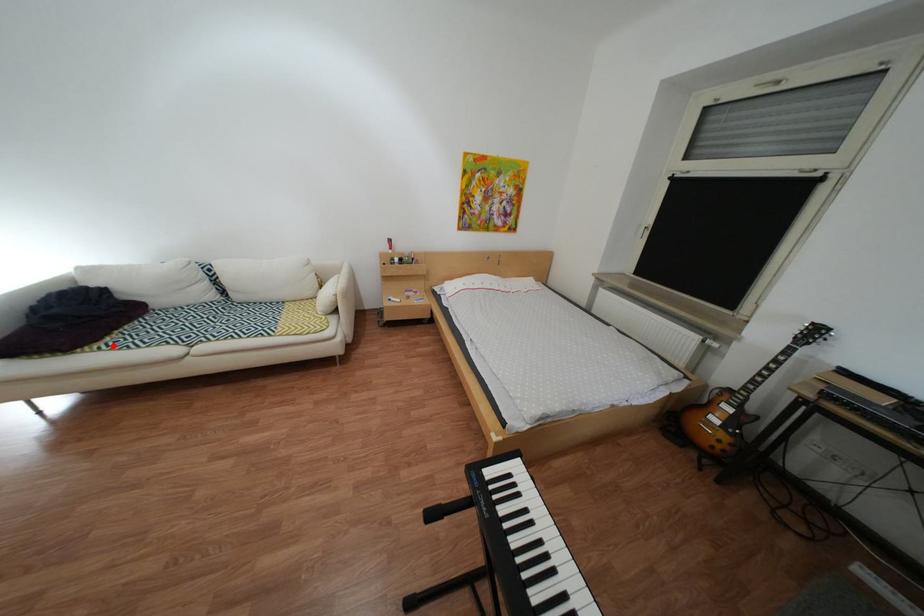
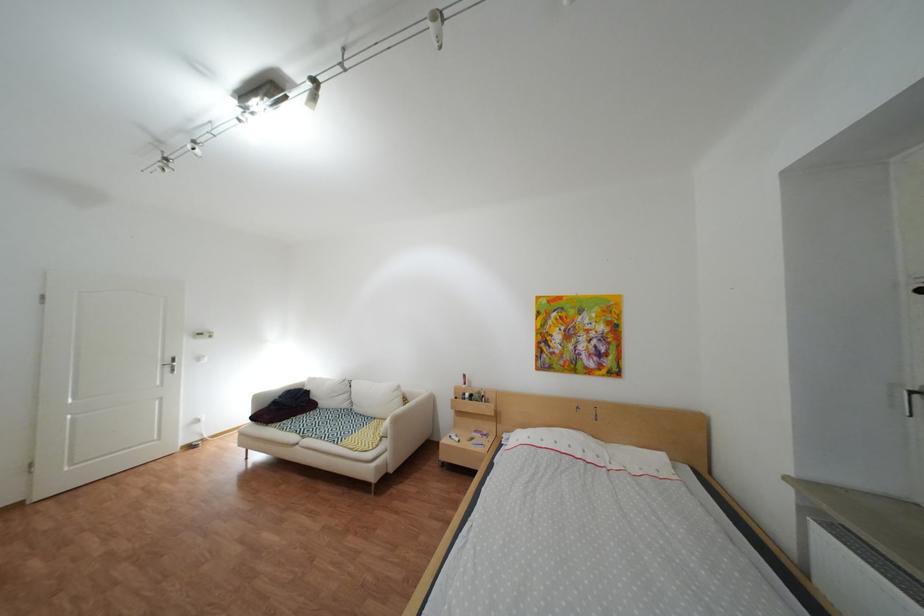
In the second image, find the point that corresponds to the highlighted location in the first image.

(294, 424)